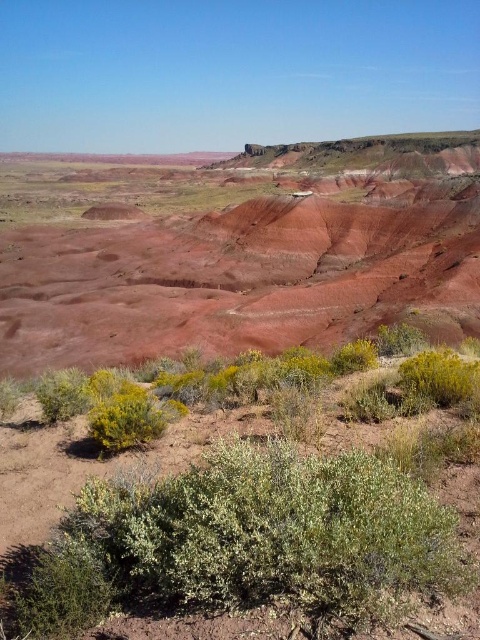
Question: Does rustic clay hillside at center have a lesser width compared to green leafy bush at lower right?

Choices:
 (A) yes
 (B) no

Answer: (B)

Question: In this image, where is rustic clay hillside at center located relative to green leafy bush at lower right?

Choices:
 (A) left
 (B) right

Answer: (A)

Question: Which object is farther from the camera taking this photo?

Choices:
 (A) rustic clay hillside at center
 (B) green leafy bush at lower right

Answer: (A)

Question: Which point appears farthest from the camera in this image?

Choices:
 (A) (40, 227)
 (B) (417, 385)

Answer: (A)

Question: Does rustic clay hillside at center appear on the right side of green leafy bush at lower right?

Choices:
 (A) yes
 (B) no

Answer: (B)